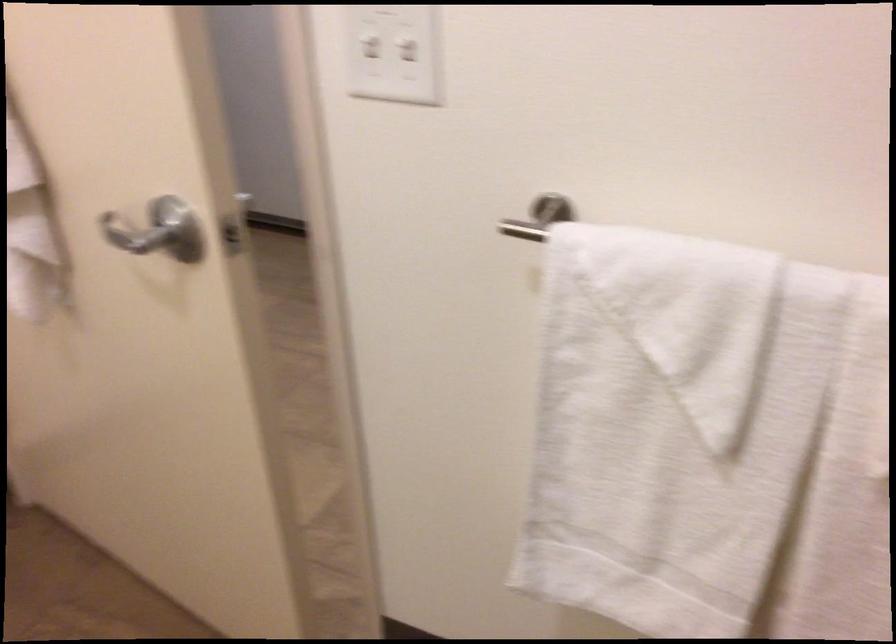
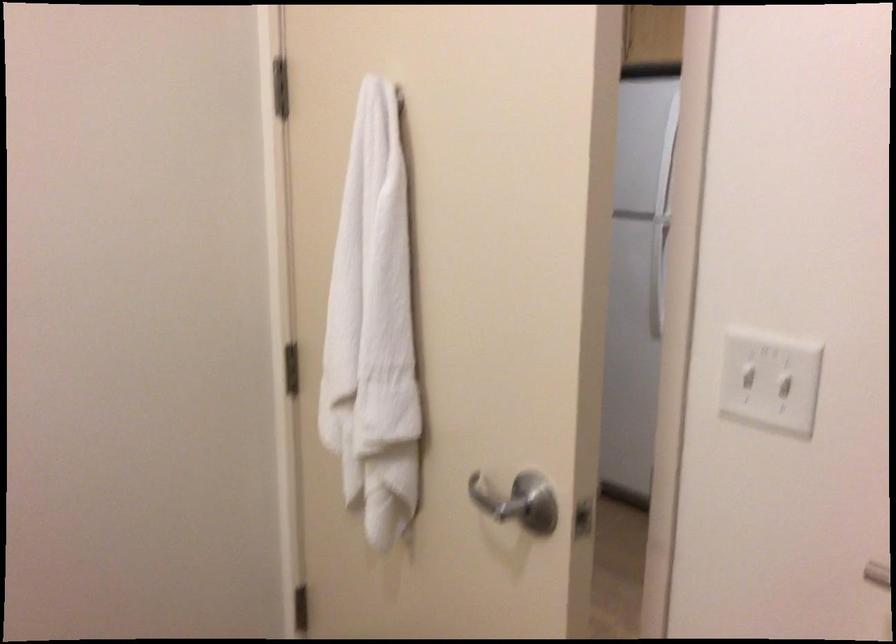
Where in the second image is the point corresponding to pixel 135 238 from the first image?

(494, 500)